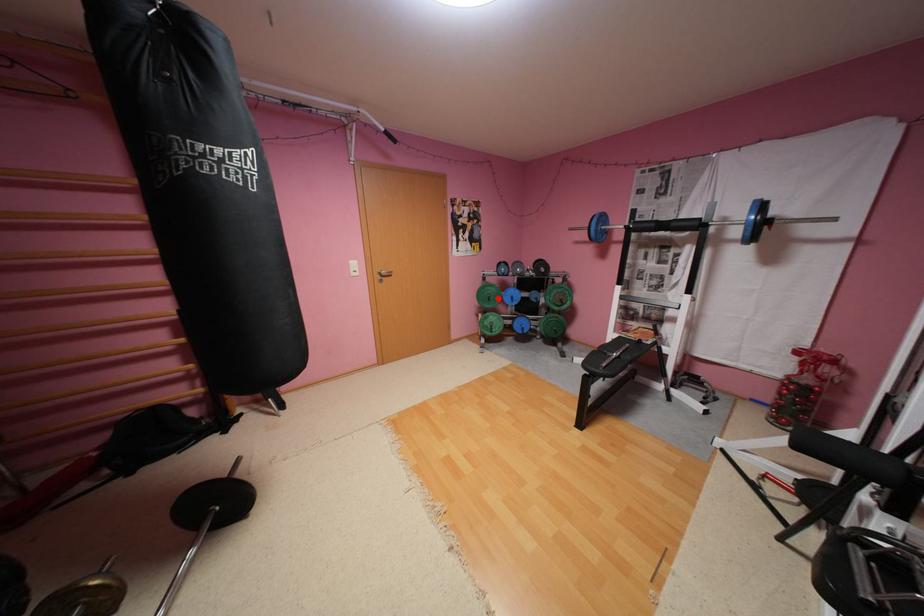
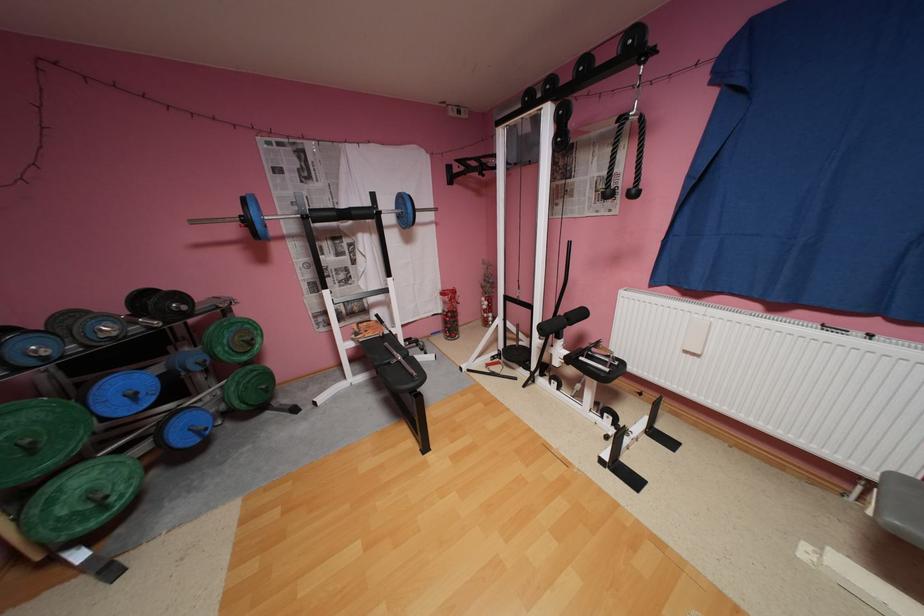
Find the pixel in the second image that matches the highlighted location in the first image.

(40, 448)